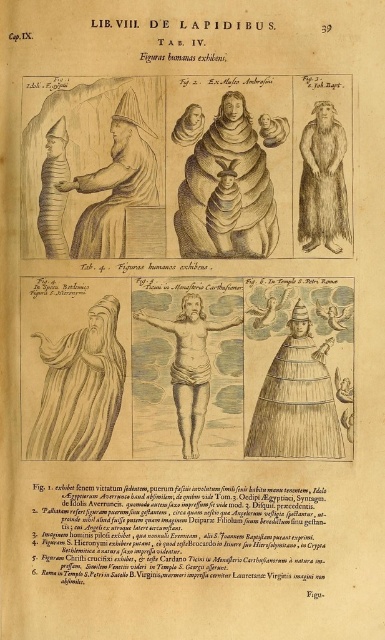
Is golden textured cone at center thinner than wooden statue at left?

Indeed, golden textured cone at center has a lesser width compared to wooden statue at left.

Does golden textured cone at center appear over wooden statue at left?

No, golden textured cone at center is not above wooden statue at left.

Does point (274, 426) lie behind point (113, 138)?

Yes.

The height and width of the screenshot is (640, 385). In order to click on golden textured cone at center in this screenshot , I will do `click(296, 400)`.

Which is above, smooth white robe at left or smooth skin figure at center?

smooth skin figure at center is above.

Which is behind, point (70, 342) or point (199, 429)?

The point (70, 342) is more distant.

Where is `smooth white robe at left`? Image resolution: width=385 pixels, height=640 pixels. smooth white robe at left is located at coordinates (80, 388).

From the picture: Is wooden statue at left below smooth skin figure at center?

Incorrect, wooden statue at left is not positioned below smooth skin figure at center.

Does point (68, 182) come closer to viewer compared to point (179, 320)?

Yes, point (68, 182) is closer to viewer.

Identify the location of wooden statue at left. Image resolution: width=385 pixels, height=640 pixels. (115, 186).